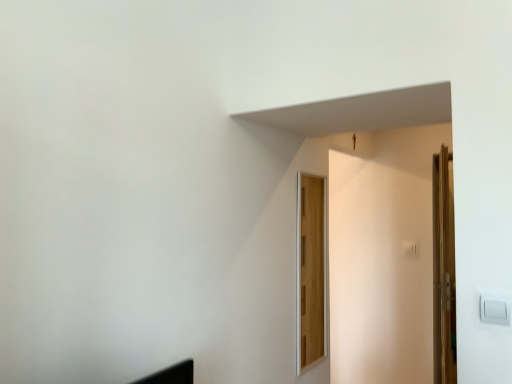
Where is `wooden door at center, which appears as the second door when viewed from the back`? The height and width of the screenshot is (384, 512). wooden door at center, which appears as the second door when viewed from the back is located at coordinates (311, 270).

Describe the element at coordinates (311, 270) in the screenshot. This screenshot has width=512, height=384. I see `wooden door at center, which is the first door in front-to-back order` at that location.

What do you see at coordinates (443, 269) in the screenshot?
I see `wooden door at right, the first door from the right` at bounding box center [443, 269].

I want to click on wooden door at right, which ranks as the 2th door in left-to-right order, so click(x=443, y=269).

Identify the location of wooden door at center, which appears as the 2th door when viewed from the right. This screenshot has height=384, width=512. (311, 270).

Which object is positioned more to the left, wooden door at right, which is the second door from front to back, or wooden door at center, which is the first door in front-to-back order?

wooden door at center, which is the first door in front-to-back order, is more to the left.

Consider the image. Does wooden door at right, the first door from the right, come behind wooden door at center, which appears as the 2th door when viewed from the right?

Yes, it is behind wooden door at center, which appears as the 2th door when viewed from the right.

Does point (437, 227) lie behind point (308, 283)?

That is False.

From the image's perspective, which object appears higher, wooden door at right, which ranks as the 2th door in left-to-right order, or wooden door at center, which is the first door in front-to-back order?

wooden door at center, which is the first door in front-to-back order, appears higher in the image.

From a real-world perspective, does wooden door at right, which appears as the first door when viewed from the back, stand above wooden door at center, which appears as the second door when viewed from the back?

No, from a real-world perspective, wooden door at right, which appears as the first door when viewed from the back, is not above wooden door at center, which appears as the second door when viewed from the back.

Considering the relative sizes of wooden door at right, which appears as the first door when viewed from the back, and wooden door at center, which is the first door in front-to-back order, in the image provided, is wooden door at right, which appears as the first door when viewed from the back, thinner than wooden door at center, which is the first door in front-to-back order,?

Incorrect, the width of wooden door at right, which appears as the first door when viewed from the back, is not less than that of wooden door at center, which is the first door in front-to-back order.

Can you confirm if wooden door at right, which is the second door from front to back, is shorter than wooden door at center, acting as the first door starting from the left?

Incorrect, the height of wooden door at right, which is the second door from front to back, does not fall short of that of wooden door at center, acting as the first door starting from the left.

In the scene shown: Can you confirm if wooden door at right, which is the second door from front to back, is smaller than wooden door at center, acting as the first door starting from the left?

Actually, wooden door at right, which is the second door from front to back, might be larger than wooden door at center, acting as the first door starting from the left.

Is wooden door at right, which is the second door from front to back, not inside wooden door at center, which appears as the second door when viewed from the back?

Absolutely, wooden door at right, which is the second door from front to back, is external to wooden door at center, which appears as the second door when viewed from the back.

Is wooden door at right, which ranks as the 2th door in left-to-right order, not close to wooden door at center, which appears as the second door when viewed from the back?

wooden door at right, which ranks as the 2th door in left-to-right order, is far away from wooden door at center, which appears as the second door when viewed from the back.

Does wooden door at right, the first door from the right, turn towards wooden door at center, acting as the first door starting from the left?

No, wooden door at right, the first door from the right, is not oriented towards wooden door at center, acting as the first door starting from the left.

What's the angular difference between wooden door at right, which ranks as the 2th door in left-to-right order, and wooden door at center, which appears as the second door when viewed from the back,'s facing directions?

wooden door at right, which ranks as the 2th door in left-to-right order, and wooden door at center, which appears as the second door when viewed from the back, are facing 10.9 degrees away from each other.

You are a GUI agent. You are given a task and a screenshot of the screen. Output one action in this format:
    pyautogui.click(x=<x>, y=<y>)
    Task: Click on the door lying on the right of wooden door at center, which is the first door in front-to-back order
    The width and height of the screenshot is (512, 384).
    Given the screenshot: What is the action you would take?
    pyautogui.click(x=443, y=269)

Which is more to the left, wooden door at center, which is the first door in front-to-back order, or wooden door at right, the first door from the right?

wooden door at center, which is the first door in front-to-back order, is more to the left.

Which is in front, wooden door at center, which appears as the second door when viewed from the back, or wooden door at right, the first door from the right?

wooden door at center, which appears as the second door when viewed from the back, is in front.

Which is closer, (313, 326) or (446, 321)?

The point (446, 321) is in front.

From the image's perspective, is wooden door at center, which is the first door in front-to-back order, above or below wooden door at right, which is the second door from front to back?

From the image's perspective, wooden door at center, which is the first door in front-to-back order, appears above wooden door at right, which is the second door from front to back.

From a real-world perspective, between wooden door at center, which appears as the second door when viewed from the back, and wooden door at right, the first door from the right, who is vertically higher?

wooden door at center, which appears as the second door when viewed from the back, is physically above.

Which of these two, wooden door at center, acting as the first door starting from the left, or wooden door at right, the first door from the right, is wider?

Wider between the two is wooden door at right, the first door from the right.

Between wooden door at center, which appears as the 2th door when viewed from the right, and wooden door at right, which ranks as the 2th door in left-to-right order, which one has more height?

wooden door at right, which ranks as the 2th door in left-to-right order, is taller.

Between wooden door at center, acting as the first door starting from the left, and wooden door at right, which ranks as the 2th door in left-to-right order, which one has larger size?

wooden door at right, which ranks as the 2th door in left-to-right order.

Could wooden door at right, which ranks as the 2th door in left-to-right order, be considered to be inside wooden door at center, which is the first door in front-to-back order?

No, wooden door at right, which ranks as the 2th door in left-to-right order, is not inside wooden door at center, which is the first door in front-to-back order.

Is wooden door at right, which is the second door from front to back, at the back of wooden door at center, which is the first door in front-to-back order?

wooden door at center, which is the first door in front-to-back order, does not have its back to wooden door at right, which is the second door from front to back.

What's the angular difference between wooden door at center, which appears as the 2th door when viewed from the right, and wooden door at right, which appears as the first door when viewed from the back,'s facing directions?

There is a 10.9-degree angle between the facing directions of wooden door at center, which appears as the 2th door when viewed from the right, and wooden door at right, which appears as the first door when viewed from the back.

Image resolution: width=512 pixels, height=384 pixels. Find the location of `door below the wooden door at center, which appears as the 2th door when viewed from the right (from the image's perspective)`. door below the wooden door at center, which appears as the 2th door when viewed from the right (from the image's perspective) is located at coordinates (443, 269).

The image size is (512, 384). What are the coordinates of `door above the wooden door at right, which is the second door from front to back (from the image's perspective)` in the screenshot? It's located at (311, 270).

Locate an element on the screen. This screenshot has width=512, height=384. door to the right of wooden door at center, acting as the first door starting from the left is located at coordinates (443, 269).